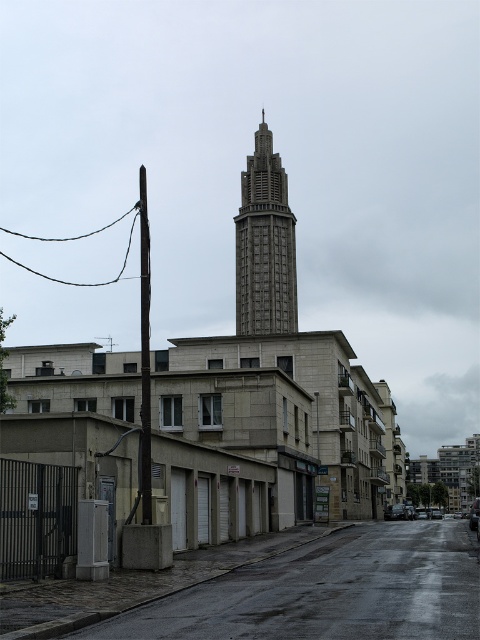
Question: Which point appears closest to the camera in this image?

Choices:
 (A) (292, 228)
 (B) (315, 625)

Answer: (B)

Question: Does concrete wall at lower left have a larger size compared to gray concrete tower at center?

Choices:
 (A) yes
 (B) no

Answer: (B)

Question: Among these objects, which one is farthest from the camera?

Choices:
 (A) gray concrete tower at center
 (B) concrete wall at lower left

Answer: (A)

Question: Can you confirm if concrete wall at lower left is thinner than gray concrete tower at center?

Choices:
 (A) yes
 (B) no

Answer: (B)

Question: Is concrete wall at lower left above gray concrete tower at center?

Choices:
 (A) no
 (B) yes

Answer: (A)